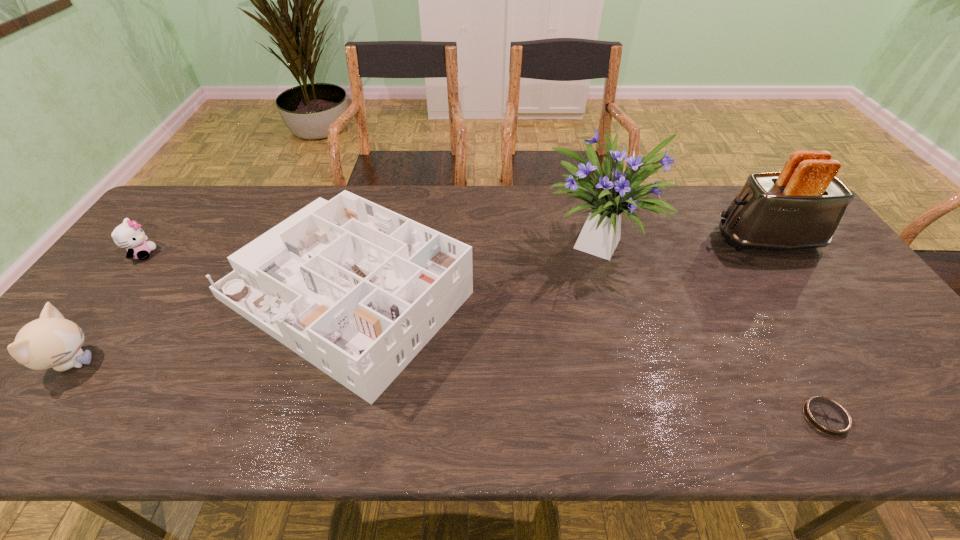
Identify the location of unoccupied area between the toaster and the flower arrangement. This screenshot has height=540, width=960. (684, 240).

Locate an element on the screen. The image size is (960, 540). free space that is in between the third object from left to right and the shortest object is located at coordinates (585, 356).

I want to click on free space between the shorter kitten and the taller kitten, so click(x=108, y=308).

Find the location of `object that stands as the fourth closest to the compass`. object that stands as the fourth closest to the compass is located at coordinates (51, 341).

Find the location of a particular element. This screenshot has width=960, height=540. the fifth closest object to the third object from right to left is located at coordinates (128, 235).

The height and width of the screenshot is (540, 960). What are the coordinates of `vacant space that satisfies the following two spatial constraints: 1. on the back side of the fourth object from right to left; 2. on the front-facing side of the shorter kitten` in the screenshot? It's located at (357, 254).

You are a GUI agent. You are given a task and a screenshot of the screen. Output one action in this format:
    pyautogui.click(x=<x>, y=<y>)
    Task: Click on the free location that satisfies the following two spatial constraints: 1. on the front-facing side of the fourth object from right to left; 2. on the right side of the shorter kitten
    Image resolution: width=960 pixels, height=540 pixels.
    Given the screenshot: What is the action you would take?
    pyautogui.click(x=110, y=295)

This screenshot has height=540, width=960. Find the location of `vacant area in the image that satisfies the following two spatial constraints: 1. on the front-facing side of the farther kitten; 2. on the left side of the dollhouse`. vacant area in the image that satisfies the following two spatial constraints: 1. on the front-facing side of the farther kitten; 2. on the left side of the dollhouse is located at coordinates click(x=110, y=295).

At what (x,y) coordinates should I click in order to perform the action: click on vacant space that satisfies the following two spatial constraints: 1. on the back side of the shortest object; 2. on the face of the nearer kitten. Please return your answer as a coordinate pair (x, y). This screenshot has width=960, height=540. Looking at the image, I should click on (794, 363).